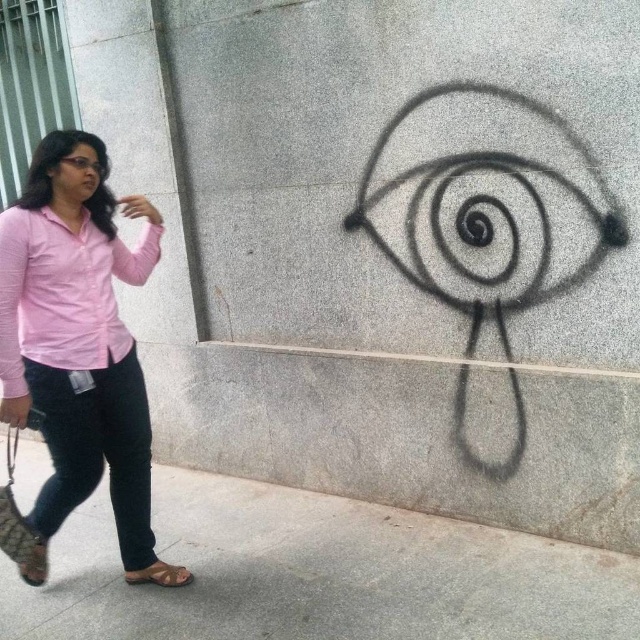
You are standing in front of the wall with the stylized eye and need to determine the distance between two specific points marked on the wall. The points are labeled as point 1 at coordinates point (45,268) and point 2 at coordinates point (38,266). Which point is closer to you?

Point (45,268) is further to the viewer than point (38,266), so point (38,266) is closer to you.

You are standing in front of the wall with the painted eye and holding a ladder. You need to reach a specific point to touch it, which is located at coordinates point (x=83, y=365). If your ladder can extend up to 6 feet, will it be sufficient to reach that point?

The distance of point (x=83, y=365) from viewer is 6.23 feet. Since the ladder can only extend up to 6 feet, it will not be sufficient to reach the point as it is 0.23 feet beyond the ladder length.

You are standing in front of the wall with the painted eye and notice the pink matte shirt at left. If you want to take a photo of the shirt while including the eye in the background, where should you position yourself relative to the shirt?

The pink matte shirt at left is located at point (x=64, y=292), so you should position yourself to the right of the shirt to ensure the eye on the wall is visible in the background.